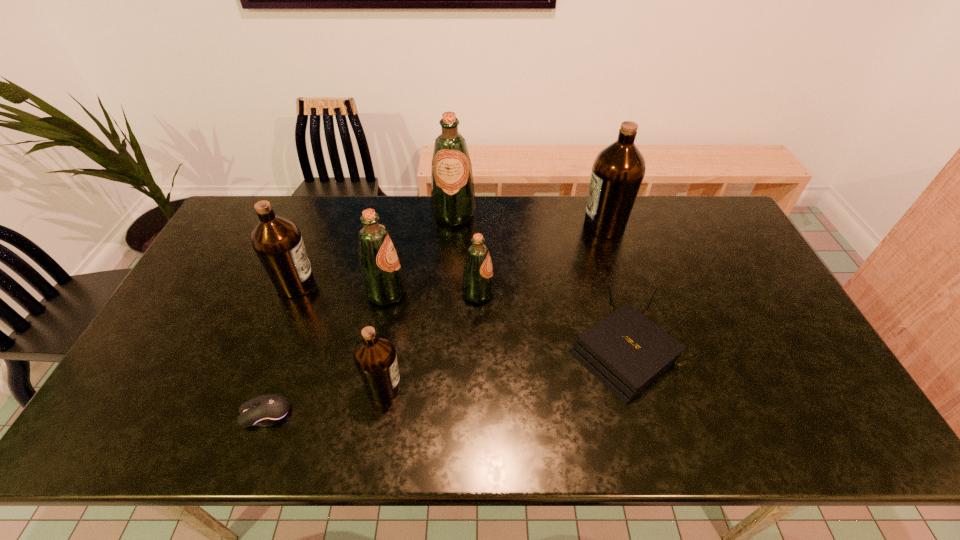
Find the location of a particular element. vacant space that is in between the router and the black computer mouse is located at coordinates (445, 383).

The width and height of the screenshot is (960, 540). Identify the location of free space between the rightmost brown olive oil and the leftmost brown olive oil. (450, 255).

The image size is (960, 540). What are the coordinates of `free spot between the biggest green olive oil and the leftmost green olive oil` in the screenshot? It's located at (420, 254).

Where is `free space between the farthest green olive oil and the black computer mouse`? free space between the farthest green olive oil and the black computer mouse is located at coordinates (360, 314).

Locate an element on the screen. The width and height of the screenshot is (960, 540). free space that is in between the biggest brown olive oil and the smallest green olive oil is located at coordinates (541, 260).

You are a GUI agent. You are given a task and a screenshot of the screen. Output one action in this format:
    pyautogui.click(x=<x>, y=<y>)
    Task: Click on the free space between the smallest brown olive oil and the smallest green olive oil
    The width and height of the screenshot is (960, 540).
    Given the screenshot: What is the action you would take?
    pyautogui.click(x=431, y=340)

The image size is (960, 540). What are the coordinates of `free spot between the black computer mouse and the black router` in the screenshot? It's located at (445, 383).

Identify which object is the fifth closest to the farthest green olive oil. Please provide its 2D coordinates. Your answer should be formatted as a tuple, i.e. [(x, y)], where the tuple contains the x and y coordinates of a point satisfying the conditions above.

[(626, 351)]

The height and width of the screenshot is (540, 960). Find the location of `object that is the second closest to the rightmost brown olive oil`. object that is the second closest to the rightmost brown olive oil is located at coordinates (478, 284).

Select which olive oil appears as the second closest to the computer mouse. Please provide its 2D coordinates. Your answer should be formatted as a tuple, i.e. [(x, y)], where the tuple contains the x and y coordinates of a point satisfying the conditions above.

[(382, 277)]